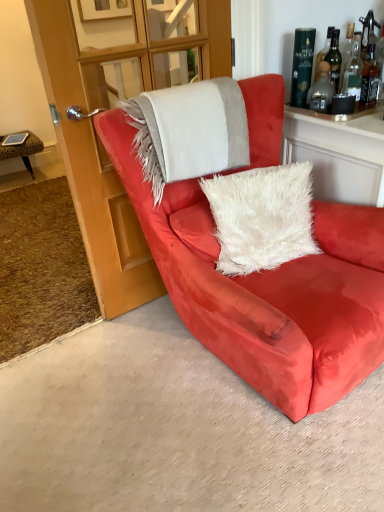
You are a GUI agent. You are given a task and a screenshot of the screen. Output one action in this format:
    pyautogui.click(x=<x>, y=<y>)
    Task: Click on the satin red armchair at center
    Image resolution: width=384 pixels, height=512 pixels.
    Given the screenshot: What is the action you would take?
    (268, 290)

The width and height of the screenshot is (384, 512). What do you see at coordinates (22, 149) in the screenshot?
I see `leopard print fabric stool at left` at bounding box center [22, 149].

What is the approximate height of green glass bottle at upper right, arranged as the third bottle when viewed from the right?

green glass bottle at upper right, arranged as the third bottle when viewed from the right, is 12.54 inches in height.

Describe the element at coordinates (302, 65) in the screenshot. I see `green glass bottle at upper right, which is counted as the 1th bottle, starting from the left` at that location.

Where is `white textured blanket at center`? This screenshot has height=512, width=384. white textured blanket at center is located at coordinates (189, 131).

This screenshot has width=384, height=512. Describe the element at coordinates (321, 91) in the screenshot. I see `translucent glass bottle at upper right, the 2th bottle when ordered from left to right` at that location.

What are the coordinates of `transparent glass door at upper center` in the screenshot? It's located at (96, 153).

Identify the location of satin red armchair at center. (268, 290).

Can you confirm if translucent amber glass bottle at upper right, which appears as the 3th bottle when viewed from the left, is thinner than leopard print fabric stool at left?

Correct, the width of translucent amber glass bottle at upper right, which appears as the 3th bottle when viewed from the left, is less than that of leopard print fabric stool at left.

Where is `bottle that is the 3rd object to the right of the leopard print fabric stool at left, starting at the anchor`? Image resolution: width=384 pixels, height=512 pixels. bottle that is the 3rd object to the right of the leopard print fabric stool at left, starting at the anchor is located at coordinates click(370, 78).

From a real-world perspective, which object rests below the other?

leopard print fabric stool at left is physically lower.

Based on the photo, considering the sizes of objects translucent amber glass bottle at upper right, which appears as the 3th bottle when viewed from the left, and leopard print fabric stool at left in the image provided, who is smaller, translucent amber glass bottle at upper right, which appears as the 3th bottle when viewed from the left, or leopard print fabric stool at left?

translucent amber glass bottle at upper right, which appears as the 3th bottle when viewed from the left, is smaller.

How many degrees apart are the facing directions of satin red armchair at center and translucent glass bottle at upper right, the 2th bottle when ordered from left to right?

satin red armchair at center and translucent glass bottle at upper right, the 2th bottle when ordered from left to right, are facing 0.000398 degrees away from each other.

From a real-world perspective, which object rests below the other?

From a 3D spatial view, satin red armchair at center is below.

Considering the relative positions of satin red armchair at center and translucent glass bottle at upper right, which is the 2th bottle from right to left, in the image provided, is satin red armchair at center to the left or to the right of translucent glass bottle at upper right, which is the 2th bottle from right to left,?

satin red armchair at center is positioned on translucent glass bottle at upper right, which is the 2th bottle from right to left,'s left side.

Considering the positions of points (364, 252) and (324, 85), is point (364, 252) closer to camera compared to point (324, 85)?

Yes, it is in front of point (324, 85).

Which bottle is the 2nd one when counting from the front of the translucent amber glass bottle at upper right, the 1th bottle in the right-to-left sequence? Please provide its 2D coordinates.

[(321, 91)]

From the image's perspective, is translucent amber glass bottle at upper right, which appears as the 3th bottle when viewed from the left, on top of translucent glass bottle at upper right, the 2th bottle when ordered from left to right?

Indeed, from the image's perspective, translucent amber glass bottle at upper right, which appears as the 3th bottle when viewed from the left, is shown above translucent glass bottle at upper right, the 2th bottle when ordered from left to right.

Looking at their sizes, would you say translucent amber glass bottle at upper right, which appears as the 3th bottle when viewed from the left, is wider or thinner than translucent glass bottle at upper right, which is the 2th bottle from right to left?

In the image, translucent amber glass bottle at upper right, which appears as the 3th bottle when viewed from the left, appears to be more narrow than translucent glass bottle at upper right, which is the 2th bottle from right to left.

Is translucent amber glass bottle at upper right, the 1th bottle in the right-to-left sequence, further to the viewer compared to translucent glass bottle at upper right, the 2th bottle when ordered from left to right?

That is True.

Is leopard print fabric stool at left positioned in front of translucent amber glass bottle at upper right, the 1th bottle in the right-to-left sequence?

No, it is not.

Is leopard print fabric stool at left facing towards translucent amber glass bottle at upper right, which appears as the 3th bottle when viewed from the left?

No, leopard print fabric stool at left does not turn towards translucent amber glass bottle at upper right, which appears as the 3th bottle when viewed from the left.

Is leopard print fabric stool at left far away from translucent amber glass bottle at upper right, which appears as the 3th bottle when viewed from the left?

Yes.

Is leopard print fabric stool at left to the left or to the right of translucent amber glass bottle at upper right, which appears as the 3th bottle when viewed from the left, in the image?

Based on their positions, leopard print fabric stool at left is located to the left of translucent amber glass bottle at upper right, which appears as the 3th bottle when viewed from the left.

Is green glass bottle at upper right, which is counted as the 1th bottle, starting from the left, thinner than leopard print fabric stool at left?

Yes.

In terms of height, does green glass bottle at upper right, arranged as the third bottle when viewed from the right, look taller or shorter compared to leopard print fabric stool at left?

Considering their sizes, green glass bottle at upper right, arranged as the third bottle when viewed from the right, has less height than leopard print fabric stool at left.

From the image's perspective, which one is positioned higher, green glass bottle at upper right, arranged as the third bottle when viewed from the right, or leopard print fabric stool at left?

leopard print fabric stool at left is shown above in the image.

From the image's perspective, which one is positioned lower, white textured blanket at center or translucent amber glass bottle at upper right, which appears as the 3th bottle when viewed from the left?

white textured blanket at center appears lower in the image.

How many degrees apart are the facing directions of white textured blanket at center and translucent amber glass bottle at upper right, the 1th bottle in the right-to-left sequence?

white textured blanket at center and translucent amber glass bottle at upper right, the 1th bottle in the right-to-left sequence, are facing 2.11 degrees away from each other.

From a real-world perspective, who is located higher, white textured blanket at center or translucent amber glass bottle at upper right, the 1th bottle in the right-to-left sequence?

translucent amber glass bottle at upper right, the 1th bottle in the right-to-left sequence.

Based on the photo, could you tell me if white textured blanket at center is turned towards translucent amber glass bottle at upper right, the 1th bottle in the right-to-left sequence?

No.

From a real-world perspective, is translucent amber glass bottle at upper right, which appears as the 3th bottle when viewed from the left, located higher than satin red armchair at center?

Yes.

Which of these two, translucent amber glass bottle at upper right, the 1th bottle in the right-to-left sequence, or satin red armchair at center, stands shorter?

translucent amber glass bottle at upper right, the 1th bottle in the right-to-left sequence, is shorter.

Is translucent amber glass bottle at upper right, which appears as the 3th bottle when viewed from the left, positioned with its back to satin red armchair at center?

translucent amber glass bottle at upper right, which appears as the 3th bottle when viewed from the left, is not turned away from satin red armchair at center.

Find the location of a particular element. bottle above the leopard print fabric stool at left (from the image's perspective) is located at coordinates (370, 78).

Identify the location of chair that is below the translucent glass bottle at upper right, which is the 2th bottle from right to left (from the image's perspective). This screenshot has width=384, height=512. (268, 290).

When comparing their distances from translucent amber glass bottle at upper right, the 1th bottle in the right-to-left sequence, does transparent glass door at upper center or translucent glass bottle at upper right, the 2th bottle when ordered from left to right, seem closer?

Based on the image, translucent glass bottle at upper right, the 2th bottle when ordered from left to right, appears to be nearer to translucent amber glass bottle at upper right, the 1th bottle in the right-to-left sequence.

Based on their spatial positions, is white textured blanket at center or green glass bottle at upper right, which is counted as the 1th bottle, starting from the left, further from translucent amber glass bottle at upper right, the 1th bottle in the right-to-left sequence?

white textured blanket at center is positioned further to the anchor translucent amber glass bottle at upper right, the 1th bottle in the right-to-left sequence.

Which object lies nearer to the anchor point satin red armchair at center, translucent glass bottle at upper right, the 2th bottle when ordered from left to right, or translucent amber glass bottle at upper right, which appears as the 3th bottle when viewed from the left?

The object closer to satin red armchair at center is translucent glass bottle at upper right, the 2th bottle when ordered from left to right.

Estimate the real-world distances between objects in this image. Which object is closer to translucent amber glass bottle at upper right, which appears as the 3th bottle when viewed from the left, translucent glass bottle at upper right, the 2th bottle when ordered from left to right, or green glass bottle at upper right, which is counted as the 1th bottle, starting from the left?

Among the two, translucent glass bottle at upper right, the 2th bottle when ordered from left to right, is located nearer to translucent amber glass bottle at upper right, which appears as the 3th bottle when viewed from the left.

Based on their spatial positions, is satin red armchair at center or white textured blanket at center further from leopard print fabric stool at left?

satin red armchair at center.

Considering their positions, is green glass bottle at upper right, arranged as the third bottle when viewed from the right, positioned closer to leopard print fabric stool at left than white textured blanket at center?

Among the two, white textured blanket at center is located nearer to leopard print fabric stool at left.

From the image, which object appears to be nearer to translucent glass bottle at upper right, which is the 2th bottle from right to left, satin red armchair at center or transparent glass door at upper center?

transparent glass door at upper center is positioned closer to the anchor translucent glass bottle at upper right, which is the 2th bottle from right to left.

Based on their spatial positions, is translucent amber glass bottle at upper right, the 1th bottle in the right-to-left sequence, or leopard print fabric stool at left closer to transparent glass door at upper center?

The object closer to transparent glass door at upper center is translucent amber glass bottle at upper right, the 1th bottle in the right-to-left sequence.

Image resolution: width=384 pixels, height=512 pixels. Find the location of `glass door located between satin red armchair at center and translucent amber glass bottle at upper right, which appears as the 3th bottle when viewed from the left, in the depth direction`. glass door located between satin red armchair at center and translucent amber glass bottle at upper right, which appears as the 3th bottle when viewed from the left, in the depth direction is located at coordinates (96, 153).

I want to click on blanket located between transparent glass door at upper center and green glass bottle at upper right, arranged as the third bottle when viewed from the right, in the left-right direction, so click(x=189, y=131).

Find the location of a particular element. This screenshot has width=384, height=512. glass door situated between leopard print fabric stool at left and translucent amber glass bottle at upper right, the 1th bottle in the right-to-left sequence, from left to right is located at coordinates (96, 153).

Identify the location of blanket between satin red armchair at center and translucent amber glass bottle at upper right, which appears as the 3th bottle when viewed from the left, along the z-axis. point(189,131).